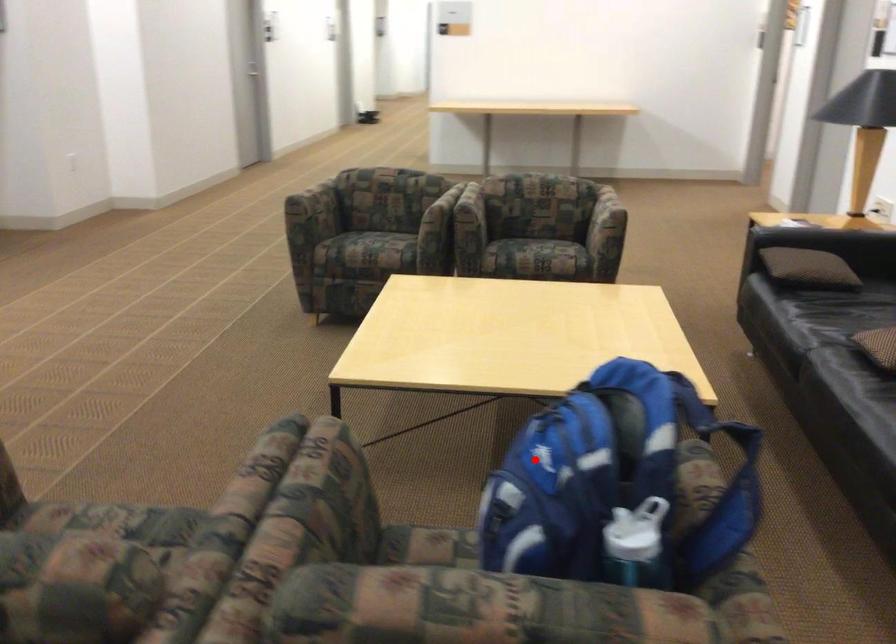
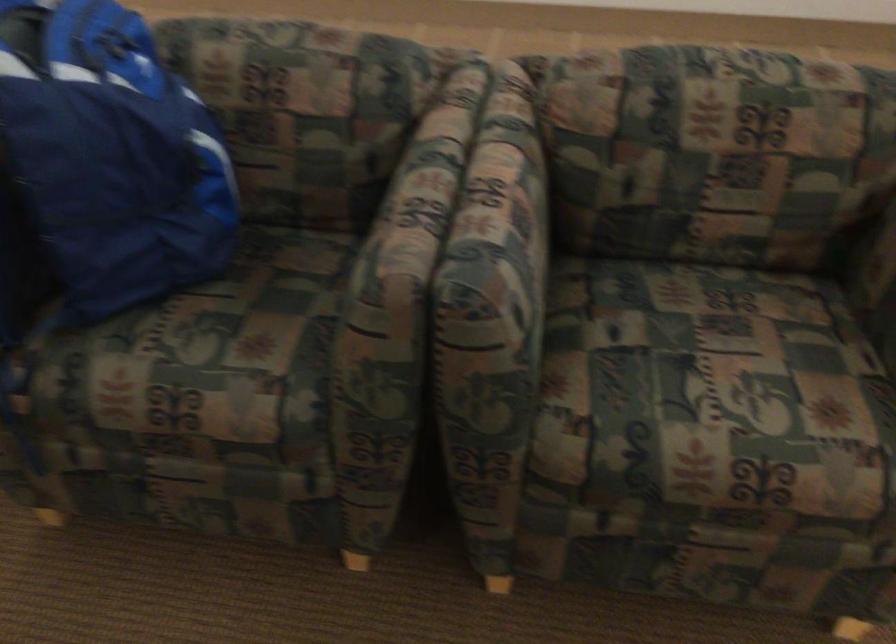
Locate, in the second image, the point that corresponds to the highlighted location in the first image.

(112, 155)